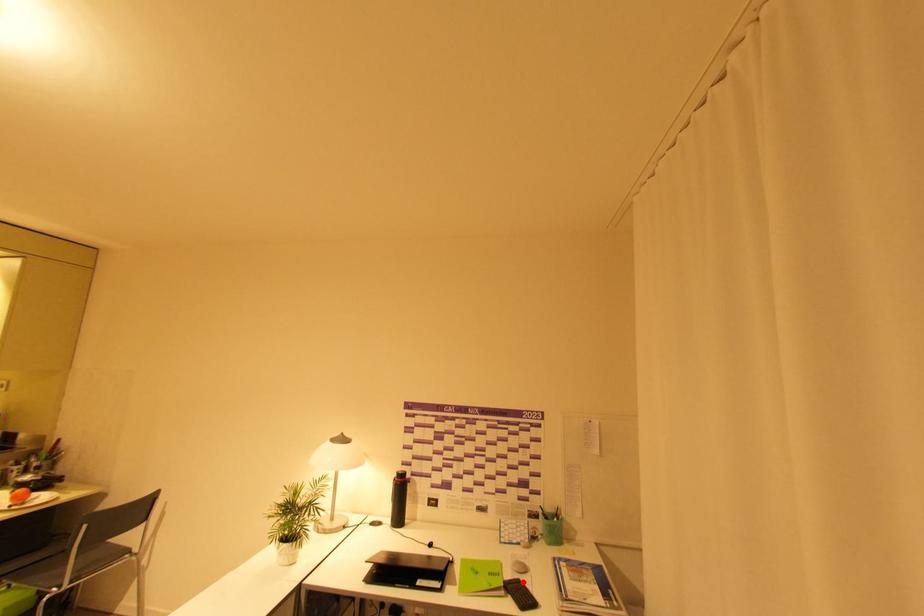
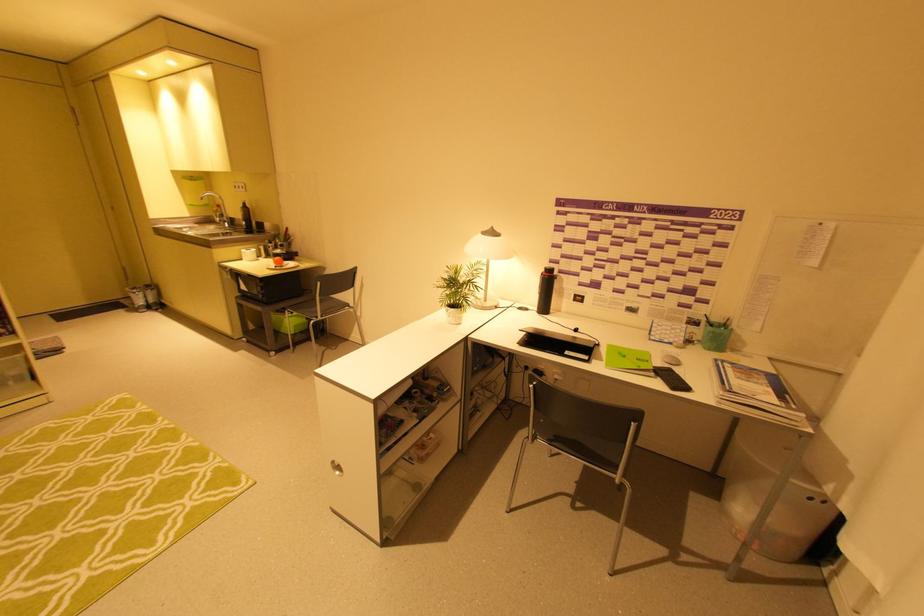
Where in the second image is the point corresponding to the highlighted location from the first image?

(675, 371)